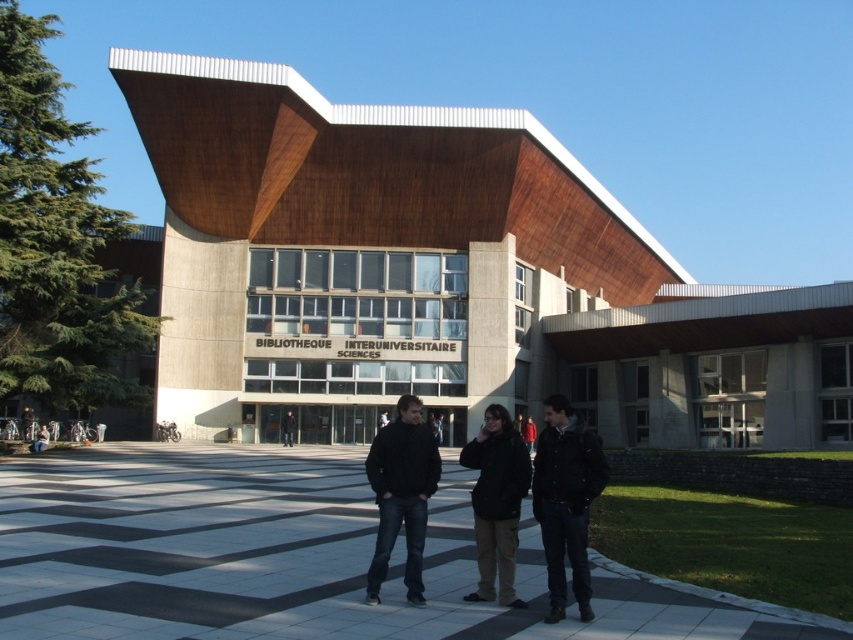
Does point (374, 563) come behind point (509, 524)?

No, it is not.

Identify the location of black matte jacket at center. (401, 493).

Where is `black matte jacket at center`? Image resolution: width=853 pixels, height=640 pixels. black matte jacket at center is located at coordinates (401, 493).

Is point (393, 474) closer to viewer compared to point (482, 435)?

Yes.

This screenshot has width=853, height=640. I want to click on dark blue jeans at center, so click(496, 502).

Identify the location of dark blue jeans at center. (496, 502).

Consider the image. Is dark blue jeans at center closer to the viewer compared to black matte jacket at center?

Yes, it is in front of black matte jacket at center.

Who is positioned more to the right, dark blue jeans at center or black matte jacket at center?

From the viewer's perspective, dark blue jeans at center appears more on the right side.

Locate an element on the screen. This screenshot has height=640, width=853. dark blue jeans at center is located at coordinates (496, 502).